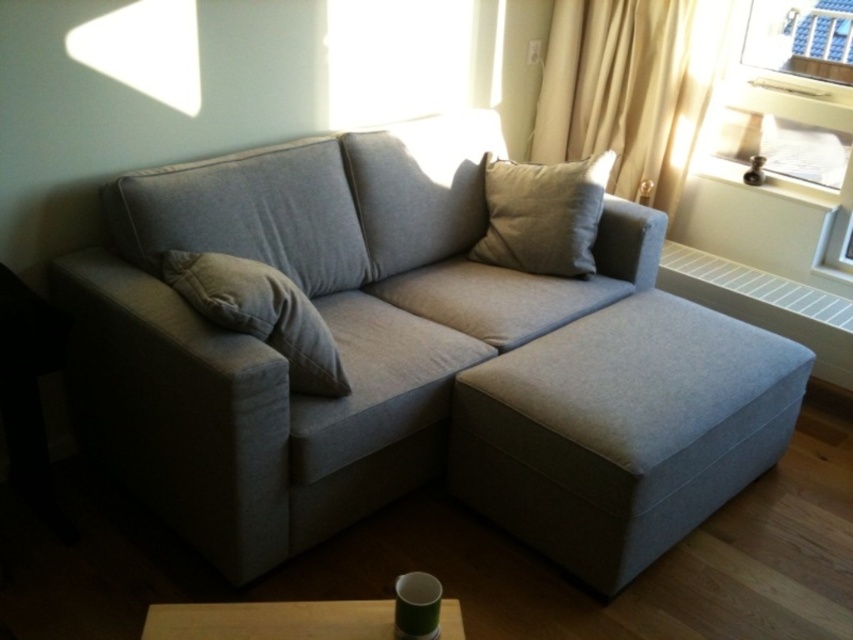
Who is more forward, [598,42] or [465,65]?

Point [465,65]

Does beige fabric curtain at upper right have a lesser height compared to transparent glass window at upper center?

In fact, beige fabric curtain at upper right may be taller than transparent glass window at upper center.

Is point (637, 179) in front of point (491, 38)?

No, (637, 179) is behind (491, 38).

Identify the location of beige fabric curtain at upper right. This screenshot has height=640, width=853. (631, 88).

Is matte gray ottoman at lower right taller than clear glass window at upper right?

Yes.

Locate an element on the screen. The image size is (853, 640). matte gray ottoman at lower right is located at coordinates (622, 429).

Measure the distance between point (653, 422) and camera.

6.30 feet

Locate an element on the screen. The width and height of the screenshot is (853, 640). matte gray ottoman at lower right is located at coordinates (622, 429).

In the scene shown: Can you confirm if beige fabric curtain at upper right is positioned below wooden table at lower center?

Actually, beige fabric curtain at upper right is above wooden table at lower center.

Does beige fabric curtain at upper right have a lesser height compared to wooden table at lower center?

No, beige fabric curtain at upper right is not shorter than wooden table at lower center.

Who is more distant from viewer, (723, 16) or (281, 609)?

Point (723, 16)

Identify the location of beige fabric curtain at upper right. (631, 88).